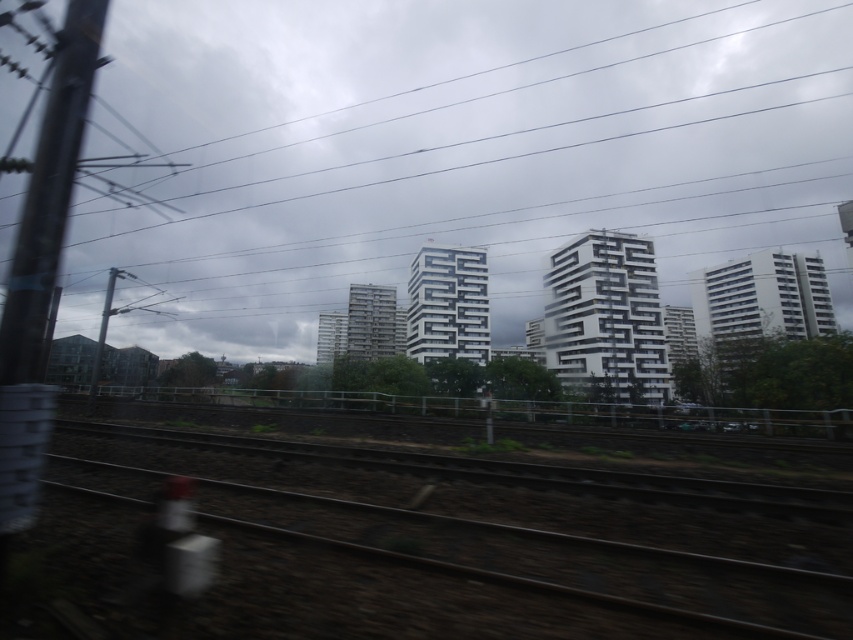
You are a photographer trying to capture a landscape shot from the train window. You notice the white matte building at center and the brown dirt at bottom. Which object would appear taller in your photo?

The white matte building at center appears taller than the brown dirt at bottom in the photo.

You are standing at the point marked as point (456,150). What can you see directly in front of you?

At point (456,150) lies white matte building at center.

You are a photographer trying to capture the white matte building at center and the brown dirt at bottom in your shot. Which object should you focus on first if you want to include both in your frame?

The white matte building at center is bigger than brown dirt at bottom, so you should focus on the white matte building at center first to ensure it fits properly in the frame.